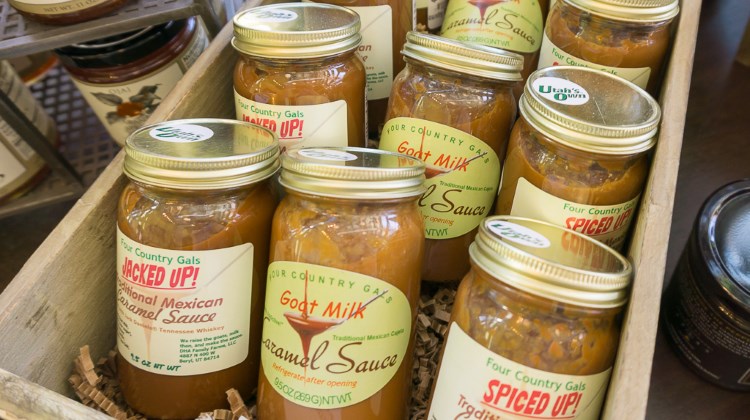
What are the coordinates of `shelving` in the screenshot? It's located at (75, 140), (25, 38).